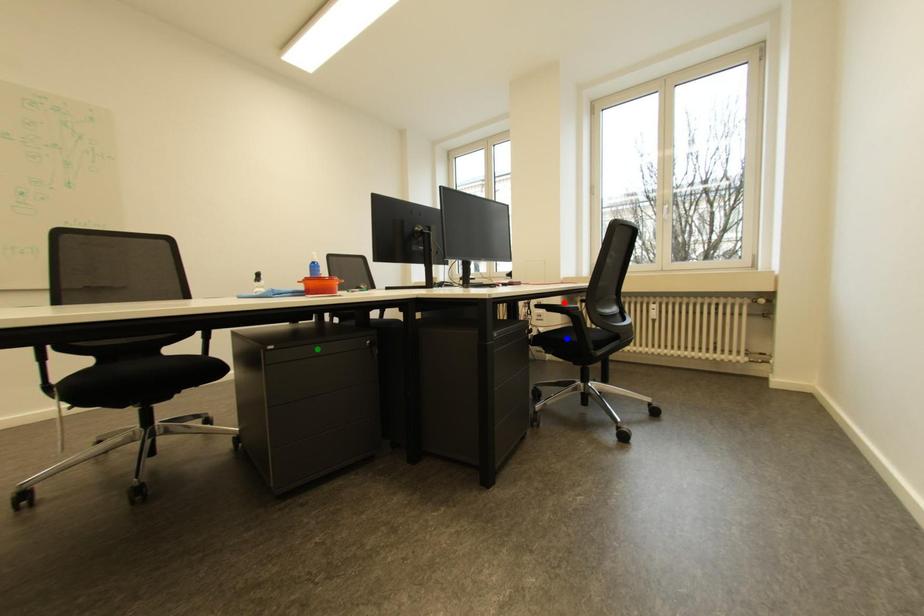
Order these from nearest to farthest:
green point
blue point
red point

green point → blue point → red point